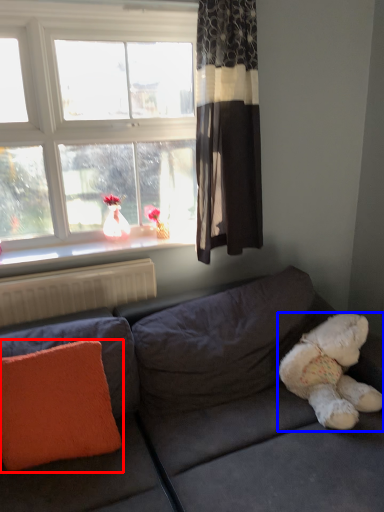
Question: Which object is closer to the camera taking this photo, pillow (highlighted by a red box) or teddy bear (highlighted by a blue box)?

Choices:
 (A) pillow
 (B) teddy bear

Answer: (A)